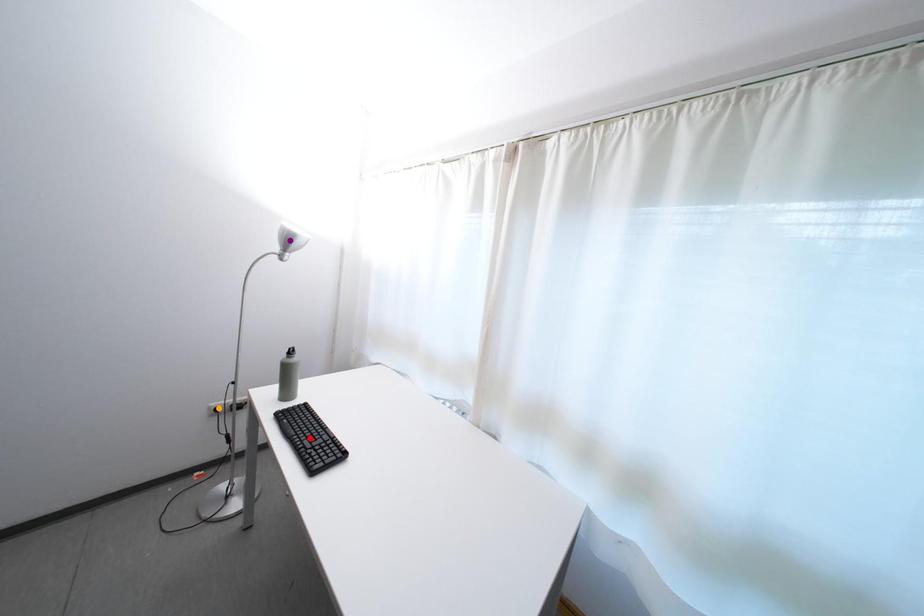
Order these from nearest to farthest:
purple point, red point, orange point

1. red point
2. orange point
3. purple point